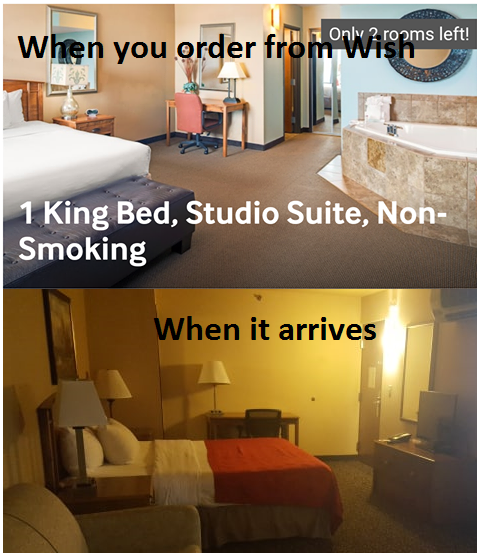
Identify the location of bed. (208, 474).